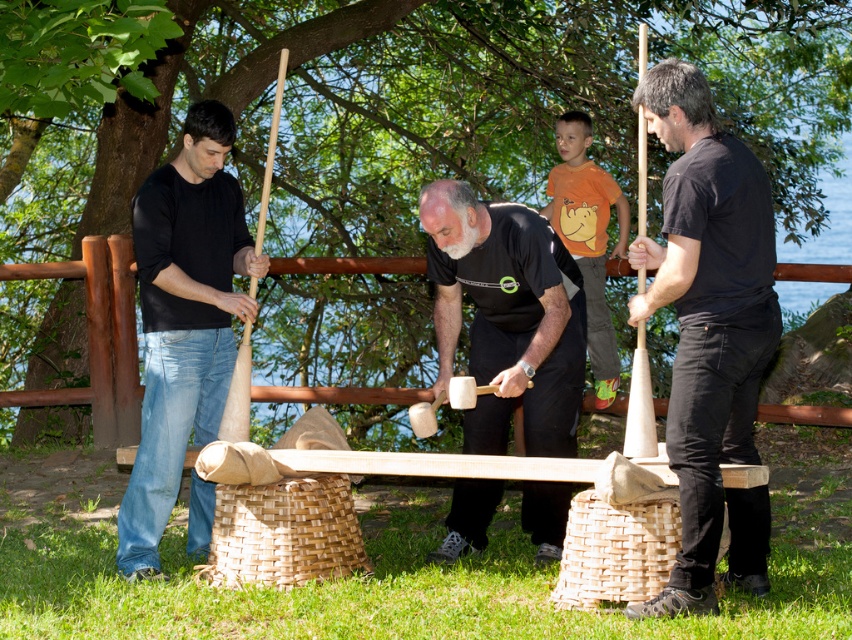
Please describe the position of the black matte shirt at right in the scene using the coordinate system provided in the Objects Description.

The black matte shirt at right is located at coordinate point 0.519 on the x axis and 0.833 on the y axis.

You are standing at the center of the grassy area and want to walk towards the point labeled as point (683,337). Which direction should you walk relative to the point labeled as point (528,451)?

You should walk towards the direction of point (683,337), which is in front of point (528,451).

What is located at the coordinates point (507, 316) in the image?

The point (507, 316) is on smooth wooden mallets at center.